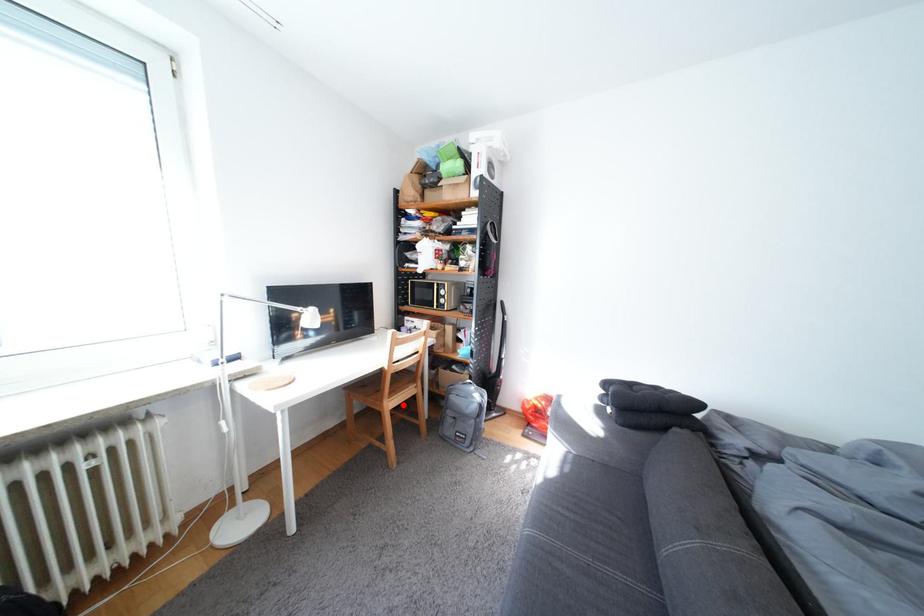
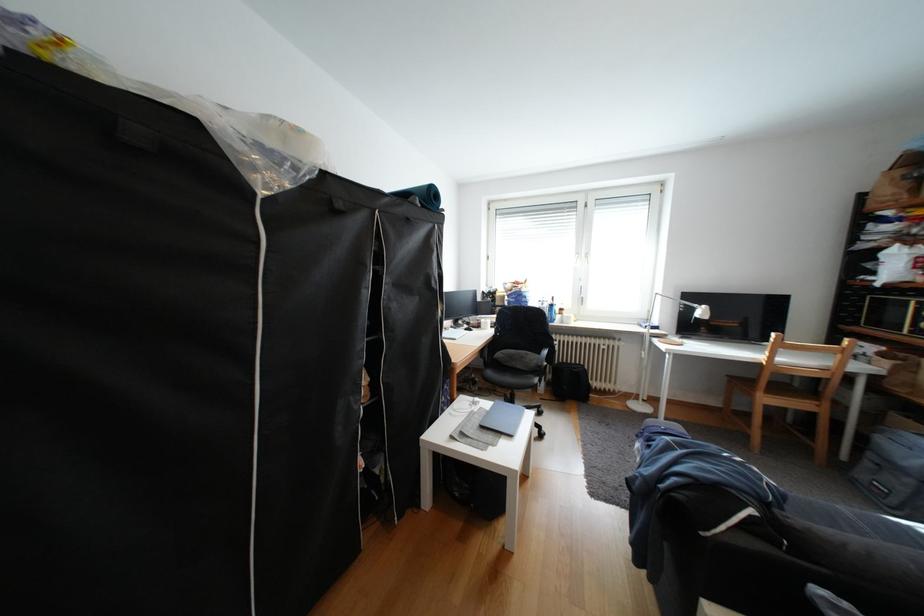
Where in the second image is the point corresponding to the highlighted location from the first image?

(779, 400)